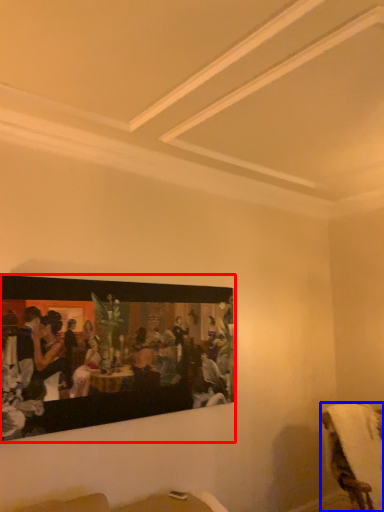
Question: Which point is further to the camera, picture frame (highlighted by a red box) or furniture (highlighted by a blue box)?

Choices:
 (A) picture frame
 (B) furniture

Answer: (B)